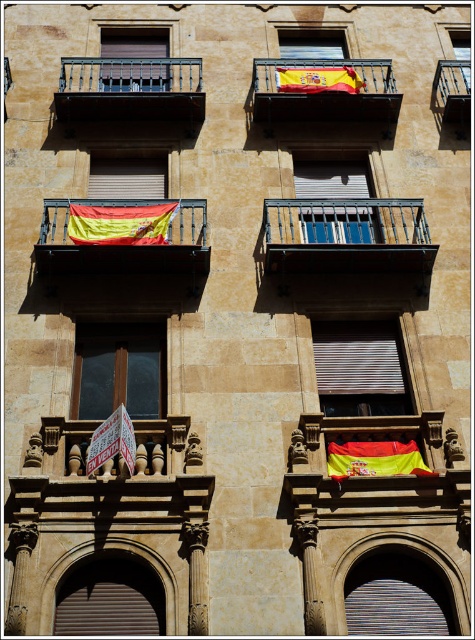
Question: Among these points, which one is nearest to the camera?

Choices:
 (A) (114, 442)
 (B) (311, 218)

Answer: (A)

Question: Which object is the closest to the matte glass window at center?

Choices:
 (A) matte gray shutters at center
 (B) red and yellow fabric flag at lower center
 (C) metallic railing at upper right

Answer: (B)

Question: Is wooden carved balcony at center positioned in front of matte metal window at upper left?

Choices:
 (A) yes
 (B) no

Answer: (A)

Question: Is matte metal window at upper left wider than matte gray shutters at center?

Choices:
 (A) yes
 (B) no

Answer: (A)

Question: Does matte metal window at center have a lesser width compared to red/yellow striped fabric at upper center?

Choices:
 (A) no
 (B) yes

Answer: (A)

Question: Which of the following is the farthest from the observer?

Choices:
 (A) coord(211,480)
 (B) coord(342,477)
 (C) coord(104,54)
 (D) coord(65,236)

Answer: (C)